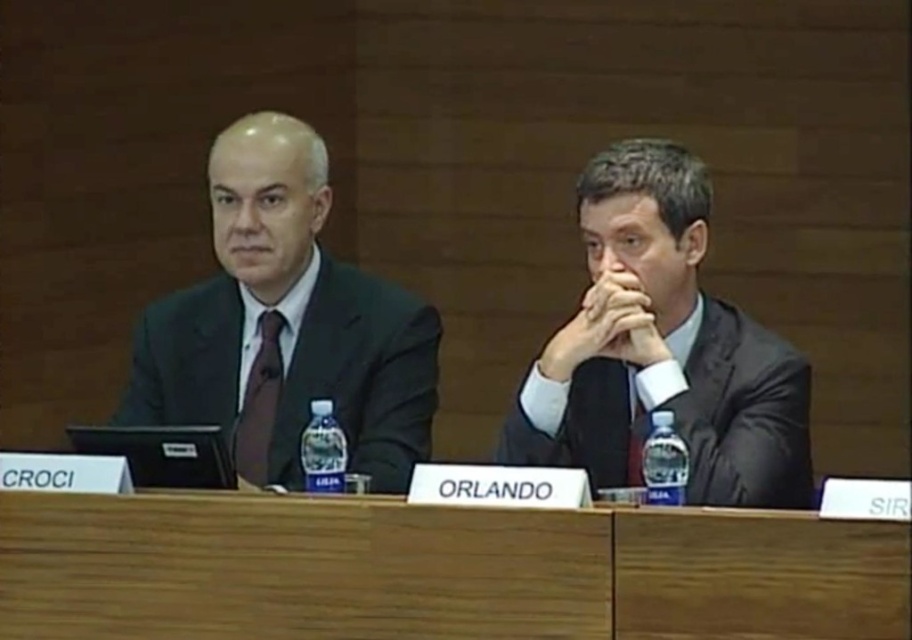
Can you confirm if matte black suit at left is taller than dark gray suit at center?

Correct, matte black suit at left is much taller as dark gray suit at center.

Can you confirm if matte black suit at left is positioned to the left of dark gray suit at center?

Indeed, matte black suit at left is positioned on the left side of dark gray suit at center.

Is point (434, 316) more distant than point (589, 189)?

Yes, it is.

Where is `matte black suit at left`? The height and width of the screenshot is (640, 912). matte black suit at left is located at coordinates [285, 324].

Does matte black suit at left have a smaller size compared to matte brown tie at center?

Actually, matte black suit at left might be larger than matte brown tie at center.

Locate an element on the screen. Image resolution: width=912 pixels, height=640 pixels. matte black suit at left is located at coordinates (285, 324).

Who is higher up, wooden at center or dark gray suit at center?

Positioned higher is dark gray suit at center.

Which of these two, wooden at center or dark gray suit at center, stands shorter?

With less height is wooden at center.

What do you see at coordinates (434, 570) in the screenshot? I see `wooden at center` at bounding box center [434, 570].

You are a GUI agent. You are given a task and a screenshot of the screen. Output one action in this format:
    pyautogui.click(x=<x>, y=<y>)
    Task: Click on the wooden at center
    This screenshot has height=640, width=912.
    Given the screenshot: What is the action you would take?
    pyautogui.click(x=434, y=570)